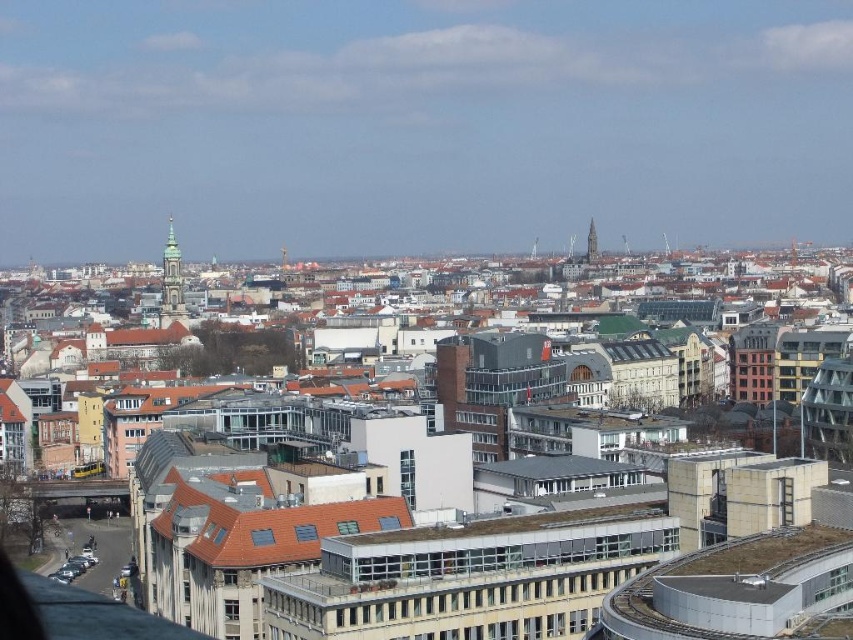
Does green stone spire at upper left appear on the left side of smooth stone tower at center?

Correct, you'll find green stone spire at upper left to the left of smooth stone tower at center.

At what (x,y) coordinates should I click in order to perform the action: click on green stone spire at upper left. Please return your answer as a coordinate pair (x, y). Looking at the image, I should click on (171, 284).